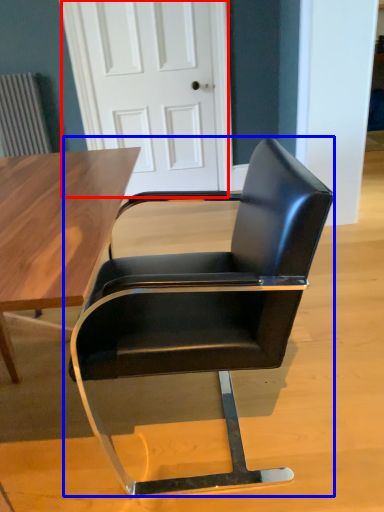
Question: Among these objects, which one is farthest to the camera, door (highlighted by a red box) or chair (highlighted by a blue box)?

Choices:
 (A) door
 (B) chair

Answer: (A)